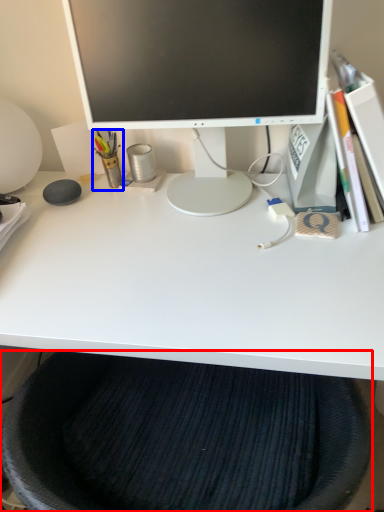
Question: Which object appears farthest to the camera in this image, computer chair (highlighted by a red box) or stationery (highlighted by a blue box)?

Choices:
 (A) computer chair
 (B) stationery

Answer: (B)